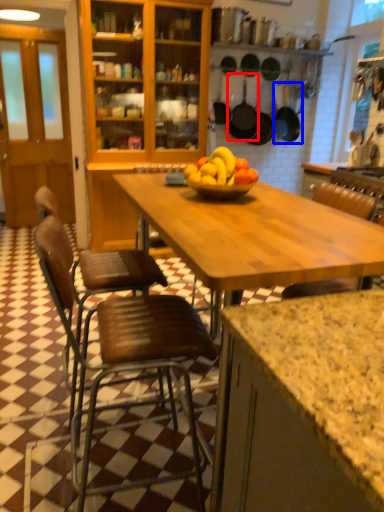
Question: Which object is further to the camera taking this photo, frying pan (highlighted by a red box) or frying pan (highlighted by a blue box)?

Choices:
 (A) frying pan
 (B) frying pan

Answer: (B)